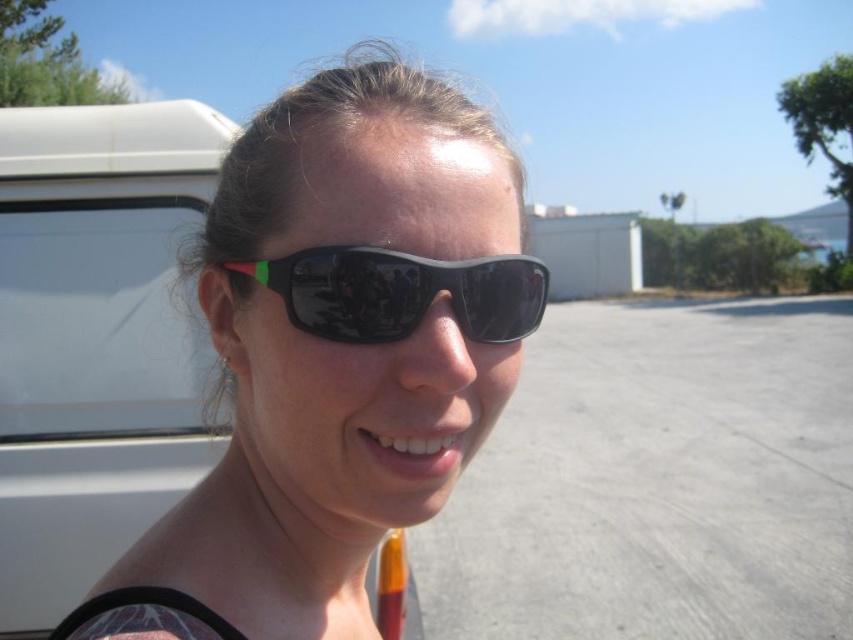
You are a photographer trying to capture both the black plastic sunglasses at center and the black rubber sunglasses at center in a single shot. Since both are at the center, can you describe their relative positions to frame them properly?

The black plastic sunglasses at center is positioned to the left of the black rubber sunglasses at center.

From the picture: You are a photographer trying to capture a detailed shot of the person wearing both the black plastic sunglasses at center and the black rubber sunglasses at center. Since you want to focus on the larger pair, which one should you zoom in on?

The black plastic sunglasses at center is larger in size than the black rubber sunglasses at center, so you should zoom in on the black plastic sunglasses at center.

In the scene shown: You are a photographer trying to capture a close shot of the person wearing sunglasses. You have a camera with a 3.0 inch lens. Can you fit both the black plastic sunglasses at center and the black rubber sunglasses at center in the frame without moving the camera?

The distance between the black plastic sunglasses at center and the black rubber sunglasses at center is 2.89 inches. Since your camera lens is 3.0 inches wide, you can fit both sunglasses in the frame without moving the camera.